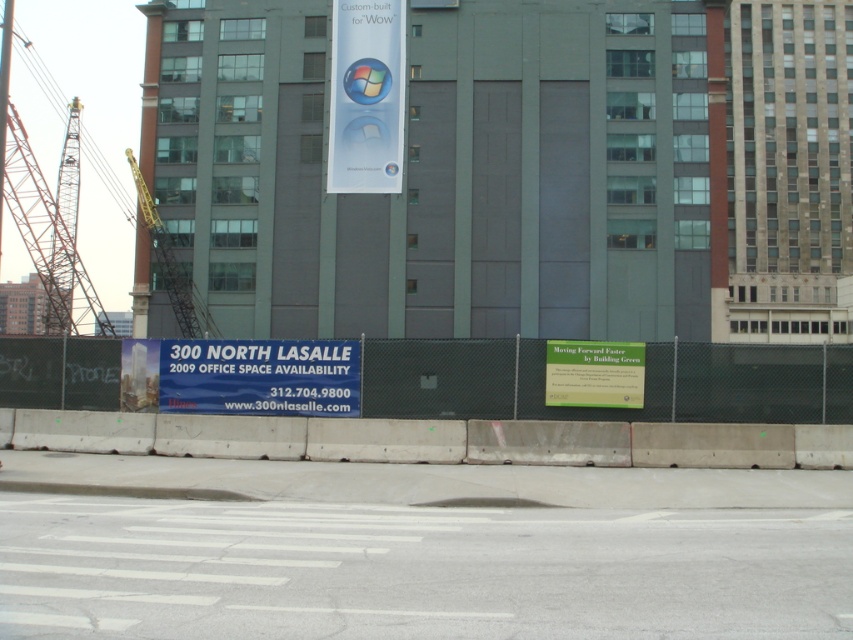
You are a delivery driver who needs to read the contact information on both the blue fabric sign at center and the green paper sign at center. However, you can only see the one that is in front. Which sign should you focus on to get the contact details?

The green paper sign at center is behind the blue fabric sign at center, so you should focus on the blue fabric sign at center since it is in front and visible.

Consider the image. You are a delivery driver who needs to enter the construction site through the main gate. The metallic gray crane at left and the green paper sign at center are visible from the gate. Which object should you look for first to ensure you are entering the correct area?

The green paper sign at center is below the metallic gray crane at left, so you should look for the green paper sign at center first as it is lower and more likely to be visible when approaching the gate.

You are standing at the construction site and see a point marked at coordinates (259, 376). Which object does this point belong to?

The point at (259, 376) is located on the blue fabric sign at center.